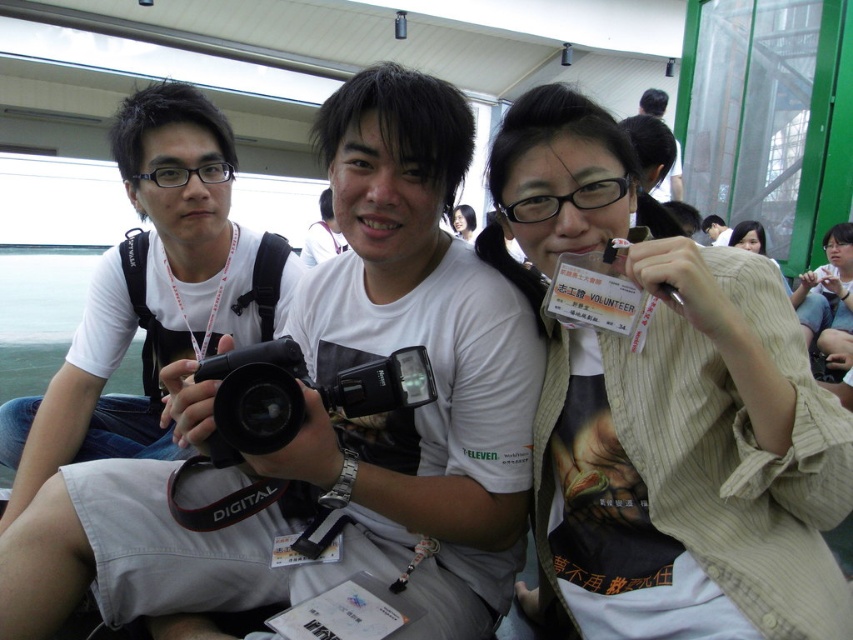
Can you confirm if black plastic camera at center is bigger than matte white shirt at center?

No, black plastic camera at center is not bigger than matte white shirt at center.

Does point (273, 371) come behind point (473, 221)?

No, (273, 371) is in front of (473, 221).

Image resolution: width=853 pixels, height=640 pixels. Identify the location of black plastic camera at center. (299, 394).

Which is more to the right, black matte camera at left or white striped shirt at center?

Positioned to the right is white striped shirt at center.

Can you confirm if black matte camera at left is positioned above white striped shirt at center?

Actually, black matte camera at left is below white striped shirt at center.

I want to click on black matte camera at left, so click(152, 294).

Describe the element at coordinates (666, 413) in the screenshot. This screenshot has width=853, height=640. I see `striped beige shirt at center` at that location.

Measure the distance between striped beige shirt at center and black matte camera at center.

striped beige shirt at center is 4.88 meters from black matte camera at center.

Locate an element on the screen. The width and height of the screenshot is (853, 640). striped beige shirt at center is located at coordinates (666, 413).